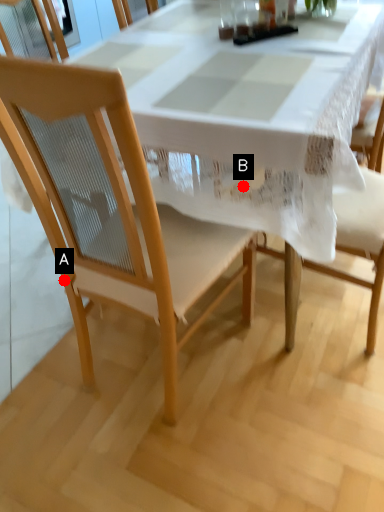
Question: Two points are circled on the image, labeled by A and B beside each circle. Among these points, which one is nearest to the camera?

Choices:
 (A) A is closer
 (B) B is closer

Answer: (B)